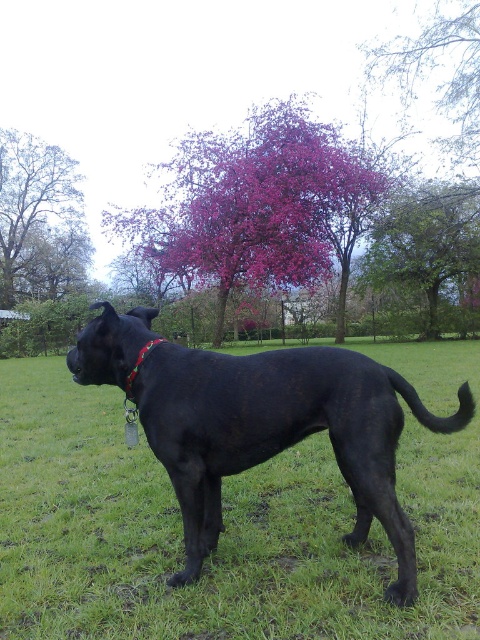
You are a drone operator trying to capture a photo of the black dog on the grassy field. The drone is currently hovering at point 0.5, 0.5. To avoid the green leafy tree at upper center, which is at point 0.380, 0.887, should you adjust the drone to the left or right? Please specify the direction to move the drone.

The green leafy tree at upper center is located at point (425, 243). The drone is at (240, 320). To avoid the tree, move the drone to the right since the tree is to the left of the drone.

You are a photographer setting up a shot of the black dog. You need to ensure that the smooth bark tree at upper left and the red fabric neckband at center are both visible in the frame. Which object will occupy more horizontal space in the photo?

The smooth bark tree at upper left will occupy more horizontal space in the photo because its width is larger than that of the red fabric neckband at center.

Looking at this image, you are a hiker who has lost your way in the woods. You see a black dog standing on a grassy field with a red collar. In the background, there are several trees. One of them is a green leafy tree at upper center. You remember that the trail back to the parking lot is located near a tree marked at point (425,243). Which tree should you head towards?

The green leafy tree at upper center is located at point (425,243), so you should head towards the green leafy tree at upper center.